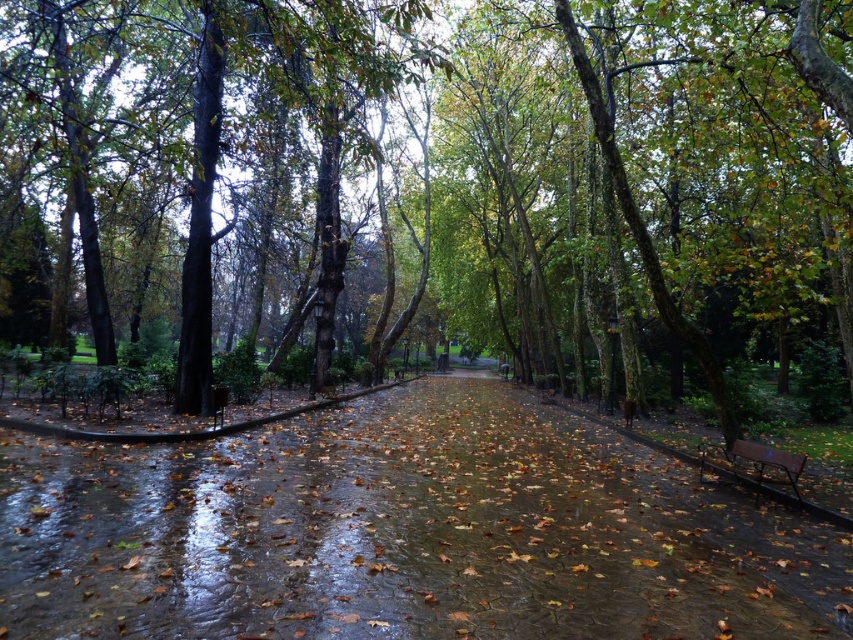
Consider the image. Is green leafy tree at center shorter than brown wooden bench at lower right?

In fact, green leafy tree at center may be taller than brown wooden bench at lower right.

Is point (798, 225) farther from camera compared to point (779, 465)?

Yes, point (798, 225) is behind point (779, 465).

I want to click on green leafy tree at center, so pyautogui.click(x=453, y=179).

Is green leafy tree at center smaller than wet concrete path at center?

No.

Looking at this image, can you confirm if green leafy tree at center is wider than wet concrete path at center?

Indeed, green leafy tree at center has a greater width compared to wet concrete path at center.

Describe the element at coordinates (453, 179) in the screenshot. The height and width of the screenshot is (640, 853). I see `green leafy tree at center` at that location.

I want to click on green leafy tree at center, so click(x=453, y=179).

Does wet concrete path at center appear on the right side of brown wooden bench at lower right?

In fact, wet concrete path at center is to the left of brown wooden bench at lower right.

Which is behind, point (737, 593) or point (769, 451)?

The point (769, 451) is behind.

The width and height of the screenshot is (853, 640). Identify the location of wet concrete path at center. (403, 532).

Identify the location of wet concrete path at center. The height and width of the screenshot is (640, 853). (403, 532).